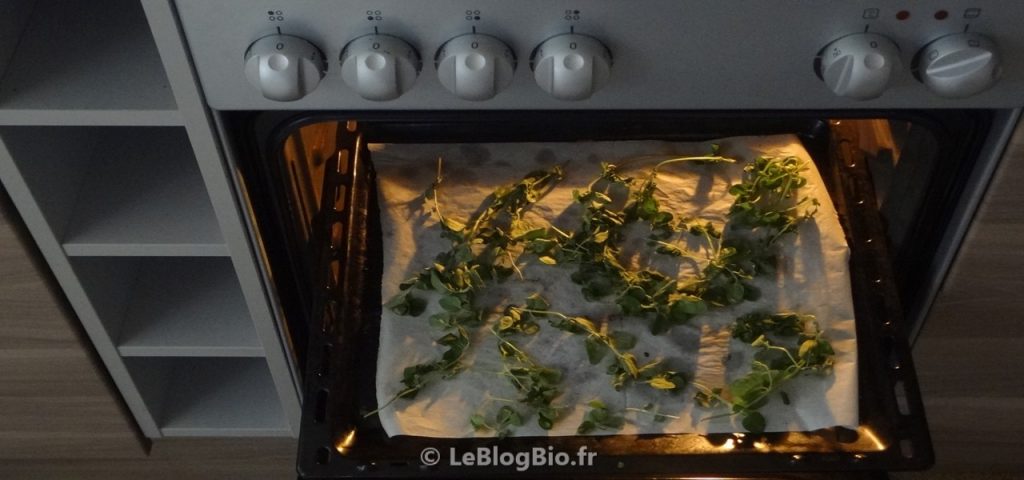
Locate an element on the screen. bottom shelf is located at coordinates (220, 412).